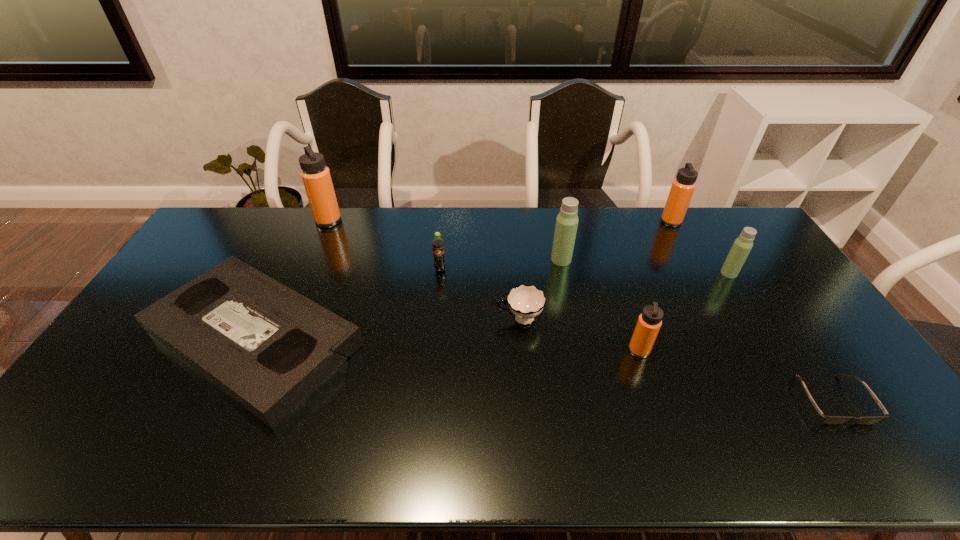
The width and height of the screenshot is (960, 540). I want to click on vacant space that is in between the videotape and the seventh tallest object, so 387,329.

The height and width of the screenshot is (540, 960). Find the location of `empty location between the black sunglasses and the rightmost thermos bottle`. empty location between the black sunglasses and the rightmost thermos bottle is located at coordinates (780, 336).

Where is `empty location between the sunglasses and the fourth thermos bottle from right to left`? The image size is (960, 540). empty location between the sunglasses and the fourth thermos bottle from right to left is located at coordinates (697, 329).

Find the location of a particular element. free area in between the farther light thermos bottle and the sixth tallest object is located at coordinates (501, 265).

I want to click on free space between the tallest thermos bottle and the seventh tallest object, so click(x=424, y=270).

Identify the location of object that is the third closest to the black sunglasses. (525, 302).

You are a GUI agent. You are given a task and a screenshot of the screen. Output one action in this format:
    pyautogui.click(x=<x>, y=<y>)
    Task: Click on the object that is the third nearest to the second nearest thermos bottle
    The image size is (960, 540).
    Given the screenshot: What is the action you would take?
    pyautogui.click(x=649, y=322)

Point out which thermos bottle is positioned as the nearest to the seventh object from left to right. Please provide its 2D coordinates. Your answer should be formatted as a tuple, i.e. [(x, y)], where the tuple contains the x and y coordinates of a point satisfying the conditions above.

[(742, 246)]

You are a GUI agent. You are given a task and a screenshot of the screen. Output one action in this format:
    pyautogui.click(x=<x>, y=<y>)
    Task: Click on the thermos bottle that is the second closest one to the nearer light thermos bottle
    
    Given the screenshot: What is the action you would take?
    pyautogui.click(x=649, y=322)

Select which orange thermos bottle appears as the second closest to the second shortest object. Please provide its 2D coordinates. Your answer should be formatted as a tuple, i.e. [(x, y)], where the tuple contains the x and y coordinates of a point satisfying the conditions above.

[(649, 322)]